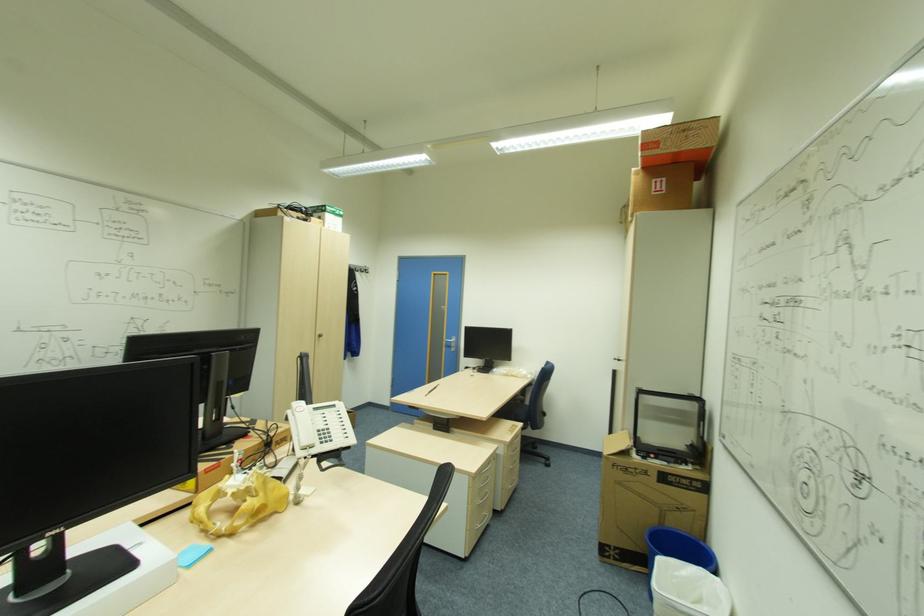
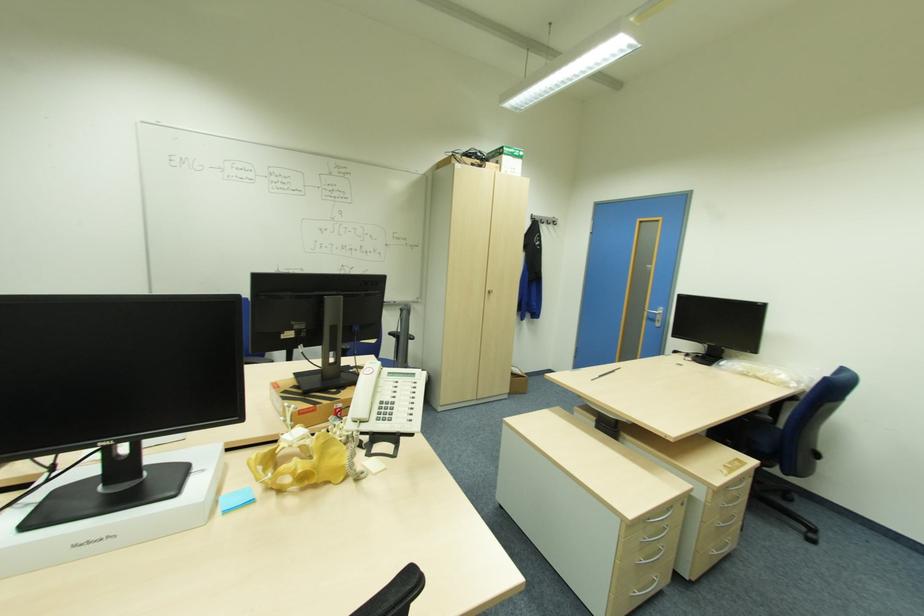
Locate, in the second image, the point that corresponds to the point at 456,346 in the first image.

(661, 321)